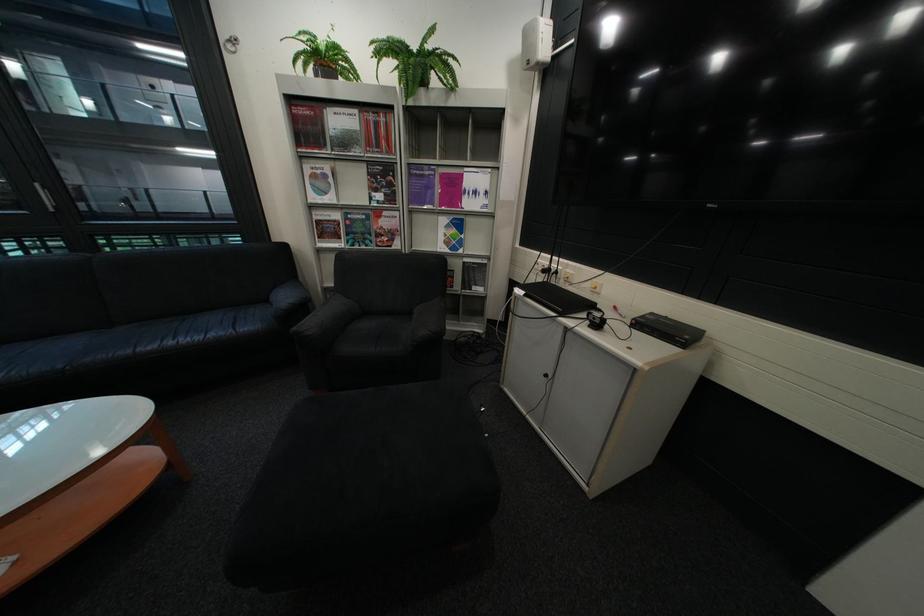
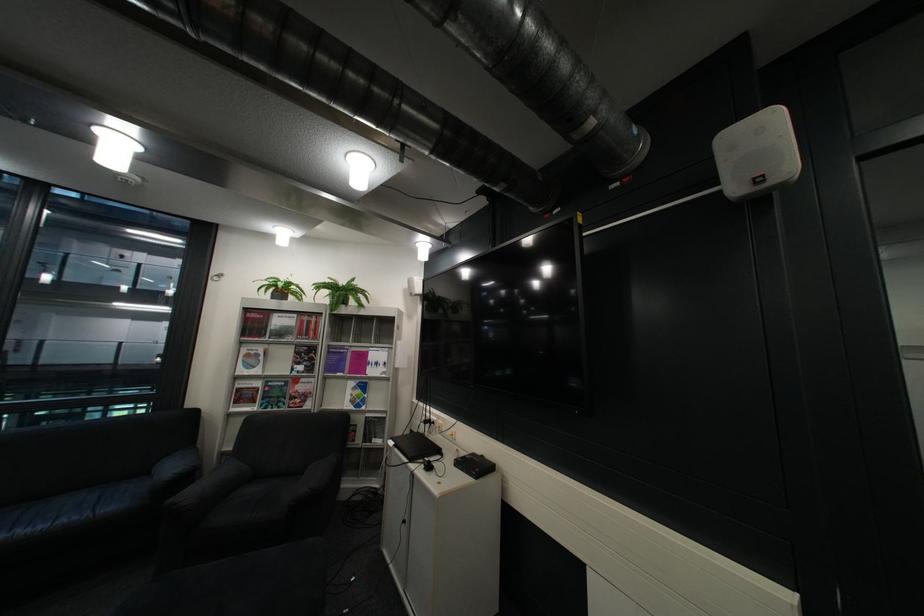
Find the pixel in the second image that matches (543,63) in the first image.

(427, 294)